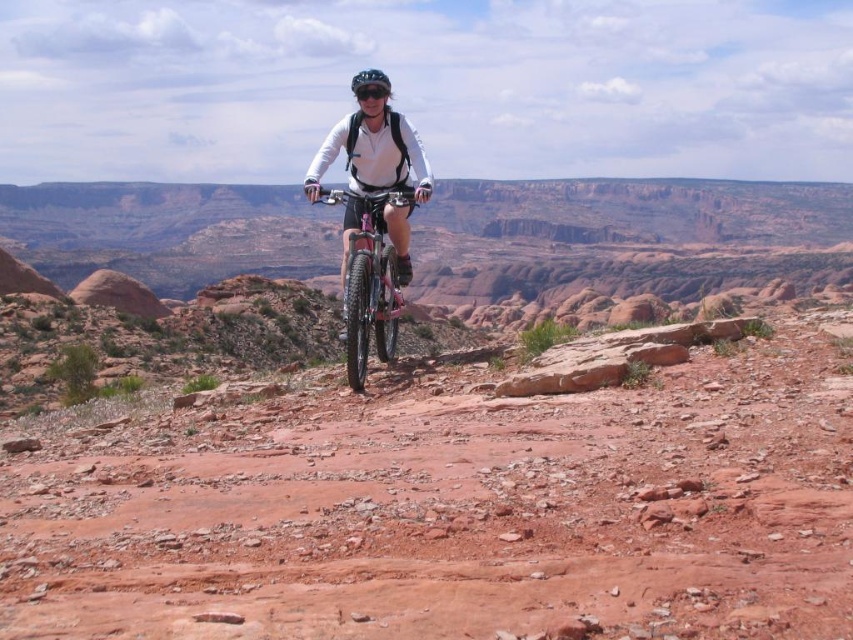
What do you see at coordinates (453, 512) in the screenshot?
I see `reddish-brown rocky dirt track at center` at bounding box center [453, 512].

Who is more forward, (120, 445) or (375, 81)?

Point (120, 445) is more forward.

Which is behind, point (554, 593) or point (355, 77)?

Positioned behind is point (355, 77).

Find the location of a particular element. The height and width of the screenshot is (640, 853). reddish-brown rocky dirt track at center is located at coordinates (453, 512).

Is reddish-brown rocky dirt track at center to the right of pink matte bicycle at center from the viewer's perspective?

Yes, reddish-brown rocky dirt track at center is to the right of pink matte bicycle at center.

Is reddish-brown rocky dirt track at center further to the viewer compared to pink matte bicycle at center?

No, reddish-brown rocky dirt track at center is in front of pink matte bicycle at center.

Between point (462, 467) and point (352, 230), which one is positioned behind?

The point (352, 230) is behind.

In order to click on reddish-brown rocky dirt track at center in this screenshot , I will do `click(453, 512)`.

Between point (355, 387) and point (387, 77), which one is positioned in front?

Point (355, 387) is in front.

Is pink matte bicycle at center shorter than matte black helmet at center?

Yes, pink matte bicycle at center is shorter than matte black helmet at center.

Between point (328, 196) and point (352, 88), which one is positioned in front?

Positioned in front is point (328, 196).

I want to click on pink matte bicycle at center, so click(x=369, y=280).